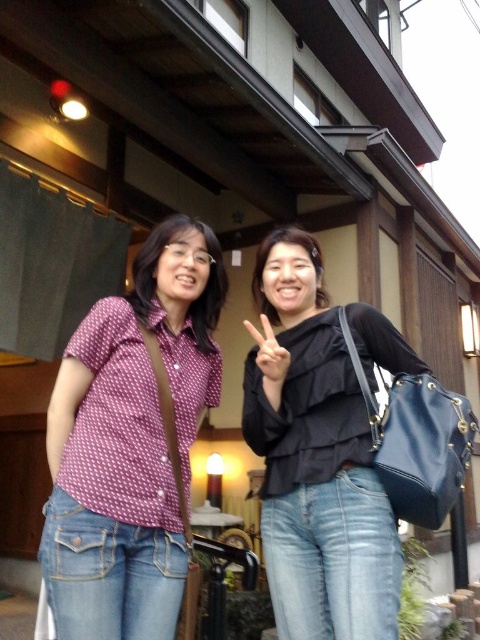
Who is lower down, denim jeans at center or white matte hand at center?

denim jeans at center is lower down.

Looking at this image, can you confirm if denim jeans at center is smaller than white matte hand at center?

No, denim jeans at center is not smaller than white matte hand at center.

This screenshot has height=640, width=480. In order to click on denim jeans at center in this screenshot , I will do `click(333, 560)`.

Does black matte top at center have a lesser width compared to denim jeans at center?

In fact, black matte top at center might be wider than denim jeans at center.

Does black matte top at center have a lesser height compared to denim jeans at center?

Incorrect, black matte top at center's height does not fall short of denim jeans at center's.

At what (x,y) coordinates should I click in order to perform the action: click on black matte top at center. Please return your answer as a coordinate pair (x, y). This screenshot has height=640, width=480. Looking at the image, I should click on (316, 461).

Consider the image. Is denim jeans at center to the left of matte black blouse at center from the viewer's perspective?

In fact, denim jeans at center is to the right of matte black blouse at center.

Can you confirm if denim jeans at center is shorter than matte black blouse at center?

No.

Find the location of `denim jeans at center`. denim jeans at center is located at coordinates (333, 560).

This screenshot has width=480, height=640. Find the location of `denim jeans at center`. denim jeans at center is located at coordinates (333, 560).